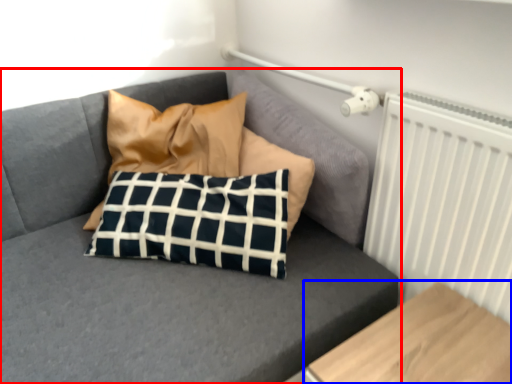
Question: Which point is closer to the camera, studio couch (highlighted by a red box) or furniture (highlighted by a blue box)?

Choices:
 (A) studio couch
 (B) furniture

Answer: (B)